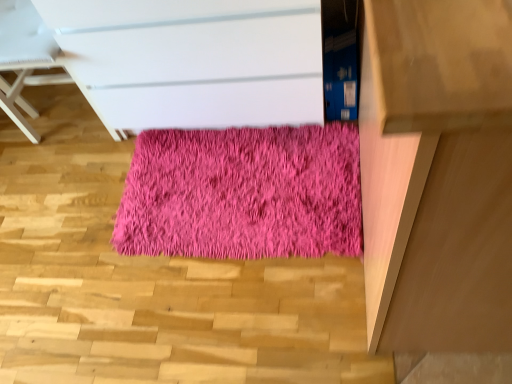
What do you see at coordinates (243, 193) in the screenshot?
I see `shaggy pink rug at center` at bounding box center [243, 193].

The height and width of the screenshot is (384, 512). What are the coordinates of `light brown wooden table at right` in the screenshot? It's located at (437, 174).

Considering their positions, is matte white chest of drawers at center located in front of or behind shaggy pink rug at center?

Visually, matte white chest of drawers at center is located in front of shaggy pink rug at center.

Is matte white chest of drawers at center thinner than shaggy pink rug at center?

No, matte white chest of drawers at center is not thinner than shaggy pink rug at center.

From a real-world perspective, is matte white chest of drawers at center under shaggy pink rug at center?

No.

Between matte white chest of drawers at center and shaggy pink rug at center, which one has less height?

Standing shorter between the two is shaggy pink rug at center.

Is pink fluffy rug at center inside shaggy pink rug at center?

No.

Is pink fluffy rug at center at the back of shaggy pink rug at center?

No, shaggy pink rug at center is not facing the opposite direction of pink fluffy rug at center.

What's the angular difference between shaggy pink rug at center and pink fluffy rug at center's facing directions?

92.7 degrees separate the facing orientations of shaggy pink rug at center and pink fluffy rug at center.

Is shaggy pink rug at center thinner than pink fluffy rug at center?

Indeed, shaggy pink rug at center has a lesser width compared to pink fluffy rug at center.

From the picture: From a real-world perspective, between shaggy pink rug at center and matte white chest of drawers at center, who is vertically higher?

From a 3D spatial view, matte white chest of drawers at center is above.

Which object is positioned more to the left, shaggy pink rug at center or matte white chest of drawers at center?

From the viewer's perspective, matte white chest of drawers at center appears more on the left side.

From the image's perspective, is shaggy pink rug at center below matte white chest of drawers at center?

Yes.

Would you say light brown wooden table at right is outside shaggy pink rug at center?

That's correct, light brown wooden table at right is outside of shaggy pink rug at center.

The image size is (512, 384). What are the coordinates of `mat beneath the light brown wooden table at right (from a real-world perspective)` in the screenshot? It's located at [x=243, y=193].

Is light brown wooden table at right placed right next to shaggy pink rug at center?

There is a gap between light brown wooden table at right and shaggy pink rug at center.

This screenshot has width=512, height=384. In order to click on stairwell in front of the light brown wooden table at right in this screenshot , I will do `click(150, 282)`.

How far apart are pink fluffy rug at center and light brown wooden table at right?

pink fluffy rug at center is 23.76 inches away from light brown wooden table at right.

Considering the relative sizes of pink fluffy rug at center and light brown wooden table at right in the image provided, is pink fluffy rug at center taller than light brown wooden table at right?

In fact, pink fluffy rug at center may be shorter than light brown wooden table at right.

Which object is positioned more to the right, pink fluffy rug at center or light brown wooden table at right?

Positioned to the right is light brown wooden table at right.

Is pink fluffy rug at center positioned beyond the bounds of shaggy pink rug at center?

Yes, pink fluffy rug at center is not within shaggy pink rug at center.

Which point is more forward, (93, 345) or (182, 144)?

The point (93, 345) is closer.

Is pink fluffy rug at center positioned before shaggy pink rug at center?

That is True.

Considering the sizes of objects pink fluffy rug at center and shaggy pink rug at center in the image provided, who is thinner, pink fluffy rug at center or shaggy pink rug at center?

shaggy pink rug at center.

How different are the orientations of light brown wooden table at right and pink fluffy rug at center in degrees?

The facing directions of light brown wooden table at right and pink fluffy rug at center are 89.5 degrees apart.

Does point (430, 284) lie behind point (24, 212)?

No, it is not.

Could you tell me if light brown wooden table at right is facing pink fluffy rug at center?

Yes, light brown wooden table at right is aimed at pink fluffy rug at center.

At what (x,y) coordinates should I click in order to perform the action: click on the chest of drawers in front of the shaggy pink rug at center. Please return your answer as a coordinate pair (x, y). The width and height of the screenshot is (512, 384). Looking at the image, I should click on (193, 60).

The image size is (512, 384). Find the location of `mat behind the pink fluffy rug at center`. mat behind the pink fluffy rug at center is located at coordinates (243, 193).

Looking at this image, looking at the image, which one is located further to shaggy pink rug at center, matte white chest of drawers at center or pink fluffy rug at center?

matte white chest of drawers at center lies further to shaggy pink rug at center than the other object.

Estimate the real-world distances between objects in this image. Which object is closer to matte white chest of drawers at center, pink fluffy rug at center or light brown wooden table at right?

pink fluffy rug at center is positioned closer to the anchor matte white chest of drawers at center.

Considering their positions, is matte white chest of drawers at center positioned further to light brown wooden table at right than shaggy pink rug at center?

Among the two, matte white chest of drawers at center is located further to light brown wooden table at right.

When comparing their distances from light brown wooden table at right, does shaggy pink rug at center or pink fluffy rug at center seem further?

Among the two, pink fluffy rug at center is located further to light brown wooden table at right.

Looking at the image, which one is located further to pink fluffy rug at center, light brown wooden table at right or matte white chest of drawers at center?

Among the two, light brown wooden table at right is located further to pink fluffy rug at center.

From the image, which object appears to be farther from light brown wooden table at right, shaggy pink rug at center or matte white chest of drawers at center?

matte white chest of drawers at center lies further to light brown wooden table at right than the other object.

Which object lies further to the anchor point matte white chest of drawers at center, light brown wooden table at right or shaggy pink rug at center?

The object further to matte white chest of drawers at center is light brown wooden table at right.

When comparing their distances from matte white chest of drawers at center, does shaggy pink rug at center or light brown wooden table at right seem closer?

shaggy pink rug at center.

Find the location of `chest of drawers between light brown wooden table at right and shaggy pink rug at center along the z-axis`. chest of drawers between light brown wooden table at right and shaggy pink rug at center along the z-axis is located at coordinates (193, 60).

This screenshot has width=512, height=384. I want to click on chest of drawers between pink fluffy rug at center and shaggy pink rug at center along the z-axis, so click(193, 60).

The width and height of the screenshot is (512, 384). What are the coordinates of `furniture between pink fluffy rug at center and shaggy pink rug at center in the front-back direction` in the screenshot? It's located at (437, 174).

Locate an element on the screen. This screenshot has width=512, height=384. furniture positioned between pink fluffy rug at center and matte white chest of drawers at center from near to far is located at coordinates pyautogui.click(x=437, y=174).